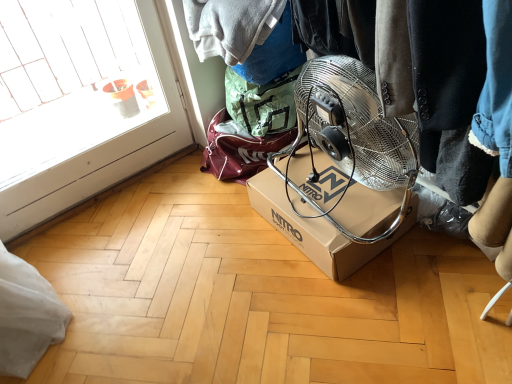
Identify the location of free point in front of transparent glass door at left. The width and height of the screenshot is (512, 384). (132, 281).